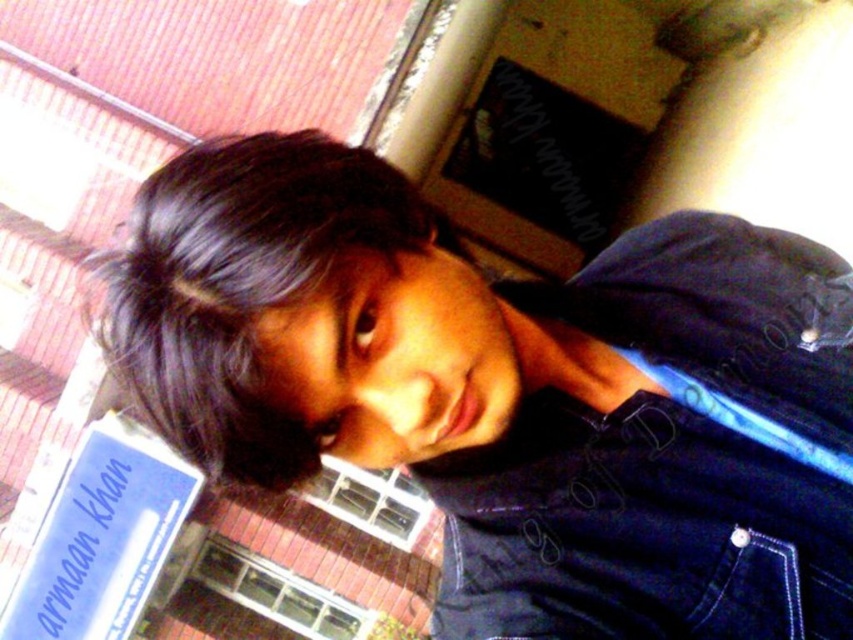
Question: Observing the image, what is the correct spatial positioning of navy blue denim jacket at lower right in reference to dark brown hair at upper left?

Choices:
 (A) below
 (B) above

Answer: (A)

Question: Is navy blue denim jacket at lower right below dark brown hair at upper left?

Choices:
 (A) yes
 (B) no

Answer: (A)

Question: Which point appears closest to the camera in this image?

Choices:
 (A) (543, 545)
 (B) (229, 385)

Answer: (B)

Question: Which of the following is the closest to the observer?

Choices:
 (A) (326, 266)
 (B) (700, 496)
 (C) (791, 301)

Answer: (A)

Question: Does dark blue denim jacket at upper right appear over dark brown hair at upper left?

Choices:
 (A) yes
 (B) no

Answer: (B)

Question: Which object is positioned closest to the dark blue denim jacket at upper right?

Choices:
 (A) navy blue denim jacket at lower right
 (B) dark brown hair at upper left

Answer: (A)